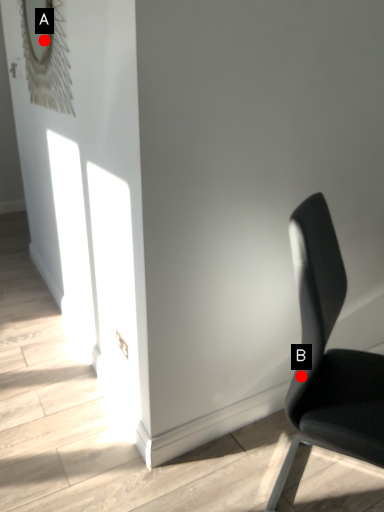
Question: Two points are circled on the image, labeled by A and B beside each circle. Which point is closer to the camera?

Choices:
 (A) A is closer
 (B) B is closer

Answer: (B)